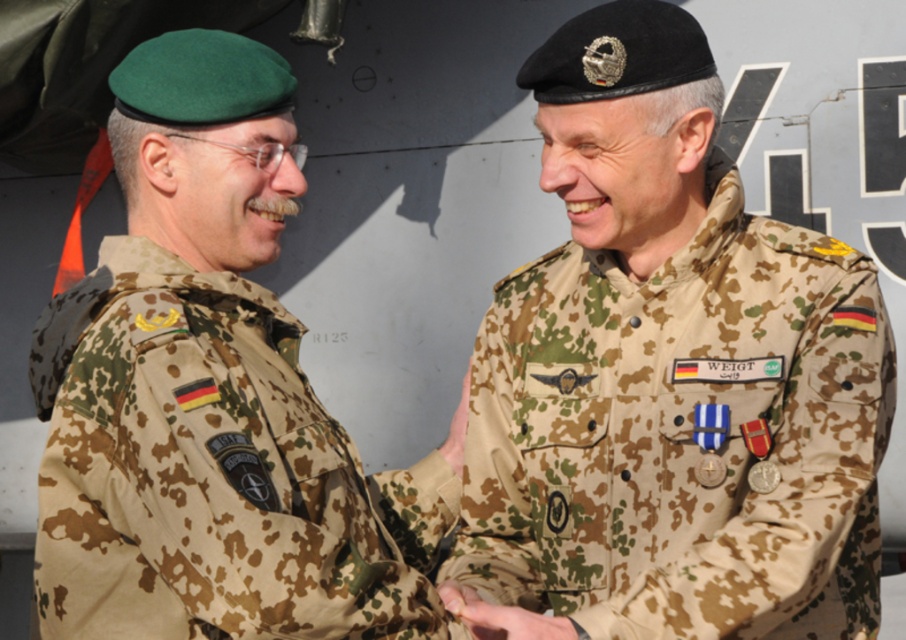
Find the location of a particular element. Image resolution: width=906 pixels, height=640 pixels. camouflage uniform at center is located at coordinates (668, 378).

Is camouflage uniform at center taller than camouflage uniform at left?

Correct, camouflage uniform at center is much taller as camouflage uniform at left.

The width and height of the screenshot is (906, 640). Find the location of `camouflage uniform at center`. camouflage uniform at center is located at coordinates click(668, 378).

Image resolution: width=906 pixels, height=640 pixels. Identify the location of camouflage uniform at center. (668, 378).